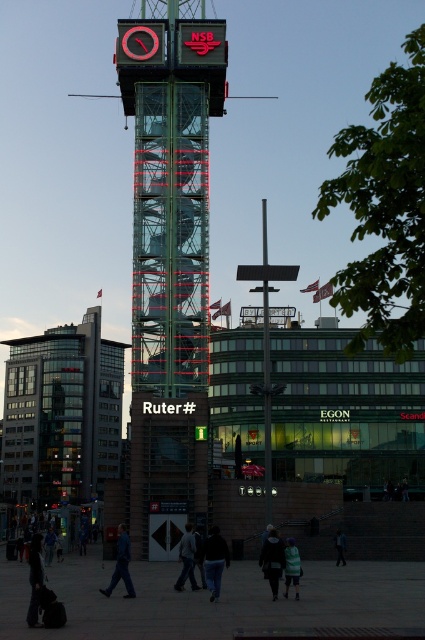
Which is more to the left, transparent glass clock tower at center or blue fabric jacket at lower center?

blue fabric jacket at lower center

Between point (187, 179) and point (79, 531), which one is positioned in front?

Point (187, 179) is in front.

The image size is (425, 640). In order to click on transparent glass clock tower at center in this screenshot , I will do `click(170, 253)`.

Is dark blue jacket at center bigger than dark gray jacket at center?

Yes.

Is dark blue jacket at center taller than dark gray jacket at center?

Yes.

I want to click on dark blue jacket at center, so click(x=272, y=561).

The image size is (425, 640). What do you see at coordinates (272, 561) in the screenshot?
I see `dark blue jacket at center` at bounding box center [272, 561].

Is dark blue jacket at center positioned before dark blue jeans at lower center?

Yes, it is.

You are a GUI agent. You are given a task and a screenshot of the screen. Output one action in this format:
    pyautogui.click(x=<x>, y=<y>)
    Task: Click on the dark blue jacket at center
    Image resolution: width=425 pixels, height=640 pixels.
    Given the screenshot: What is the action you would take?
    pyautogui.click(x=272, y=561)